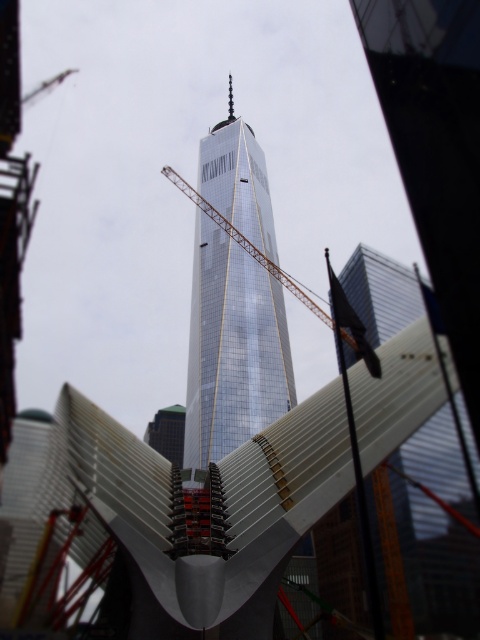
You are a city planner reviewing the urban layout. You need to determine the spatial relationship between the shiny glass skyscraper at center and the metallic gold crane at center. Which object is located to the left of the other?

The shiny glass skyscraper at center is positioned on the left side of metallic gold crane at center, so the skyscraper is to the left of the crane.

You are an urban planner assessing the construction site. Given the shiny glass skyscraper at center and the metallic gold crane at center, which object occupies more horizontal space in the image?

The metallic gold crane at center has a greater width than the shiny glass skyscraper at center, so it occupies more horizontal space in the image.